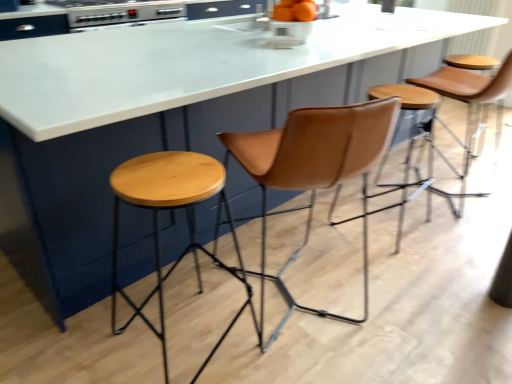
Question: Is natural wood stool at left, which is counted as the second stool, starting from the back, positioned with its back to orange matte bowl at center?

Choices:
 (A) yes
 (B) no

Answer: (B)

Question: Is natural wood stool at left, which is counted as the second stool, starting from the back, behind orange matte bowl at center?

Choices:
 (A) no
 (B) yes

Answer: (A)

Question: Considering the relative positions of natural wood stool at left, which is the first stool from left to right, and orange matte bowl at center in the image provided, is natural wood stool at left, which is the first stool from left to right, to the left of orange matte bowl at center from the viewer's perspective?

Choices:
 (A) yes
 (B) no

Answer: (A)

Question: Does natural wood stool at left, the first stool from the front, appear on the right side of orange matte bowl at center?

Choices:
 (A) no
 (B) yes

Answer: (A)

Question: Does natural wood stool at left, which is the first stool from left to right, have a lesser height compared to orange matte bowl at center?

Choices:
 (A) no
 (B) yes

Answer: (A)

Question: Can you confirm if natural wood stool at left, the first stool from the front, is smaller than orange matte bowl at center?

Choices:
 (A) yes
 (B) no

Answer: (B)

Question: From the image's perspective, does orange matte bowl at center appear higher than metallic silver oven at upper left?

Choices:
 (A) no
 (B) yes

Answer: (A)

Question: Is orange matte bowl at center shorter than metallic silver oven at upper left?

Choices:
 (A) no
 (B) yes

Answer: (B)

Question: Is orange matte bowl at center bigger than metallic silver oven at upper left?

Choices:
 (A) yes
 (B) no

Answer: (B)

Question: Can you confirm if orange matte bowl at center is smaller than metallic silver oven at upper left?

Choices:
 (A) yes
 (B) no

Answer: (A)

Question: Is orange matte bowl at center thinner than metallic silver oven at upper left?

Choices:
 (A) no
 (B) yes

Answer: (B)

Question: Is orange matte bowl at center to the left of metallic silver oven at upper left from the viewer's perspective?

Choices:
 (A) no
 (B) yes

Answer: (A)

Question: Is there a large distance between brown leather swivel chair at center and orange matte bowl at center?

Choices:
 (A) no
 (B) yes

Answer: (A)